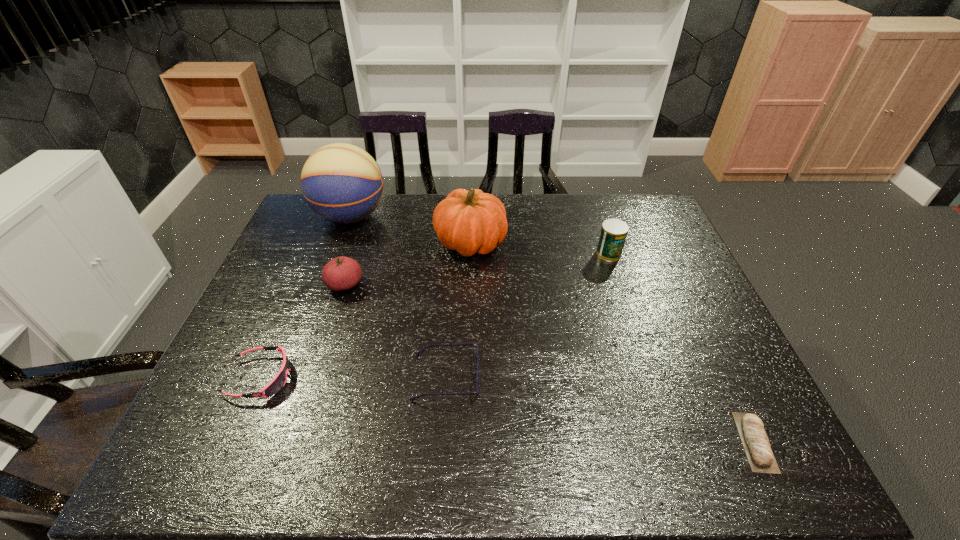
Where is `the tallest object`? This screenshot has width=960, height=540. the tallest object is located at coordinates (342, 183).

Find the location of `the second tallest object`. the second tallest object is located at coordinates (470, 222).

You are a GUI agent. You are given a task and a screenshot of the screen. Output one action in this format:
    pyautogui.click(x=<x>, y=<y>)
    Task: Click on the second object from right to left
    The height and width of the screenshot is (540, 960).
    Given the screenshot: What is the action you would take?
    pyautogui.click(x=613, y=234)

Identify the location of the fourth farthest object. (x=342, y=273).

You are a GUI agent. You are given a task and a screenshot of the screen. Output one action in this format:
    pyautogui.click(x=<x>, y=<y>)
    Task: Click on the spectacles
    This screenshot has height=540, width=960.
    Given the screenshot: What is the action you would take?
    pyautogui.click(x=421, y=351)

Where is `goggles`? goggles is located at coordinates (277, 383).

At what (x,y) coordinates should I click in order to perform the action: click on pita bread. Please return your answer as a coordinate pair (x, y). This screenshot has height=540, width=960. Looking at the image, I should click on (756, 444).

This screenshot has height=540, width=960. I want to click on the rightmost object, so click(x=756, y=444).

Find the location of `free region located 0.330m on the patterned surface of the tallest object`. free region located 0.330m on the patterned surface of the tallest object is located at coordinates (483, 217).

This screenshot has height=540, width=960. Find the location of `free space located on the right of the sixth shortest object`. free space located on the right of the sixth shortest object is located at coordinates (612, 242).